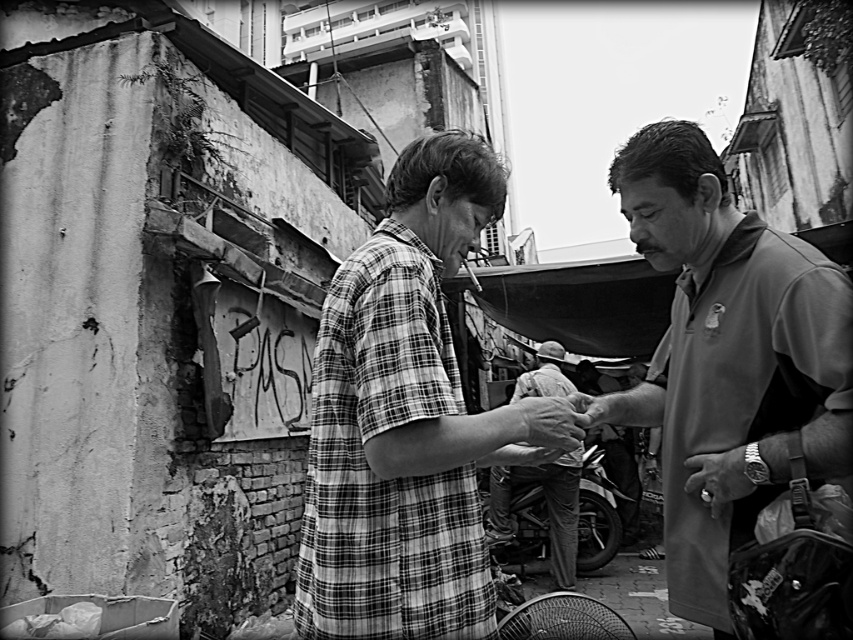
Can you confirm if plaid shirt at center is wider than smooth gray shirt at right?

Correct, the width of plaid shirt at center exceeds that of smooth gray shirt at right.

In the scene shown: Is plaid shirt at center to the right of smooth gray shirt at right from the viewer's perspective?

In fact, plaid shirt at center is to the left of smooth gray shirt at right.

Where is `plaid shirt at center`? plaid shirt at center is located at coordinates (403, 419).

Based on the photo, which is more to the left, plaid shirt at center or light gray fabric shirt at center?

plaid shirt at center

Which is below, plaid shirt at center or light gray fabric shirt at center?

light gray fabric shirt at center

You are a GUI agent. You are given a task and a screenshot of the screen. Output one action in this format:
    pyautogui.click(x=<x>, y=<y>)
    Task: Click on the plaid shirt at center
    This screenshot has width=853, height=640.
    Given the screenshot: What is the action you would take?
    pyautogui.click(x=403, y=419)

Where is `plaid shirt at center`? The width and height of the screenshot is (853, 640). plaid shirt at center is located at coordinates click(403, 419).

Looking at this image, which is below, smooth gray shirt at right or light gray fabric shirt at center?

Positioned lower is light gray fabric shirt at center.

Who is positioned more to the right, smooth gray shirt at right or light gray fabric shirt at center?

Positioned to the right is light gray fabric shirt at center.

At what (x,y) coordinates should I click in order to perform the action: click on smooth gray shirt at right. Please return your answer as a coordinate pair (x, y). Looking at the image, I should click on (727, 358).